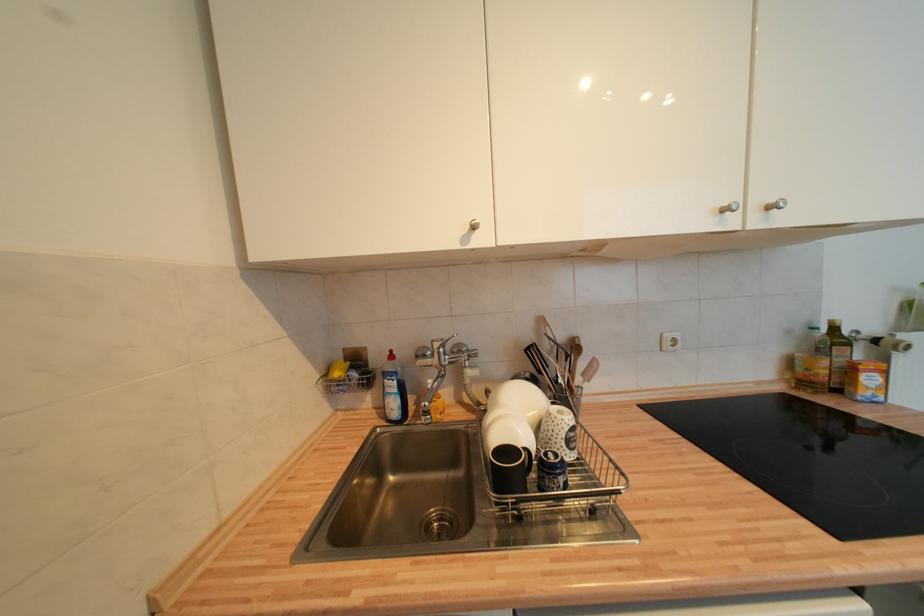
Locate an element on the screen. small blue mug is located at coordinates (508, 469).